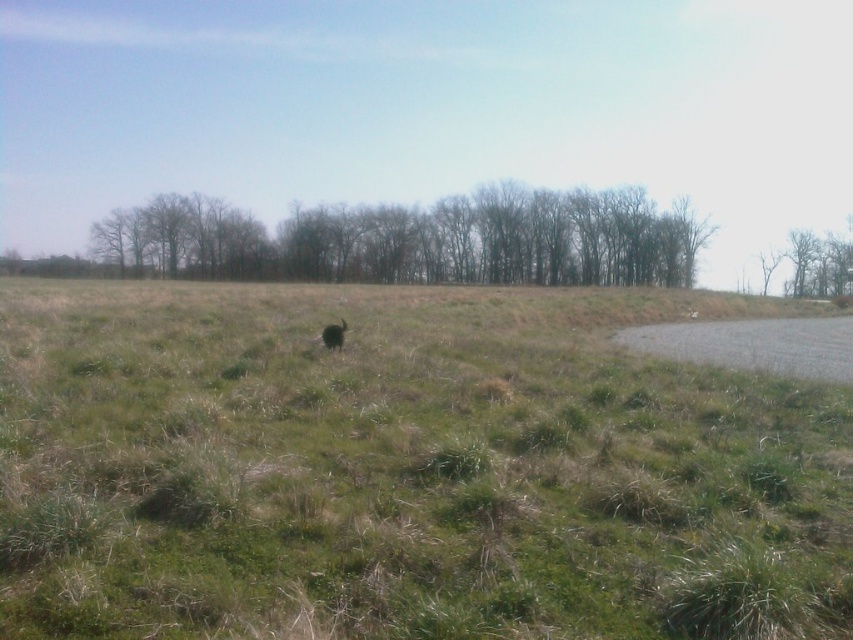
Question: Is bare branches at center closer to the viewer compared to brown furry animal at center?

Choices:
 (A) no
 (B) yes

Answer: (A)

Question: Is bare branches at center positioned before brown furry animal at center?

Choices:
 (A) yes
 (B) no

Answer: (B)

Question: From the image, what is the correct spatial relationship of green grassy field at center in relation to bare branches at center?

Choices:
 (A) below
 (B) above

Answer: (A)

Question: Considering the real-world distances, which object is farthest from the brown furry animal at center?

Choices:
 (A) green grassy field at center
 (B) bare branches at center

Answer: (B)

Question: Which point is closer to the camera?

Choices:
 (A) (126, 540)
 (B) (616, 257)

Answer: (A)

Question: Which object is positioned farthest from the green grassy field at center?

Choices:
 (A) bare branches at center
 (B) brown furry animal at center

Answer: (A)